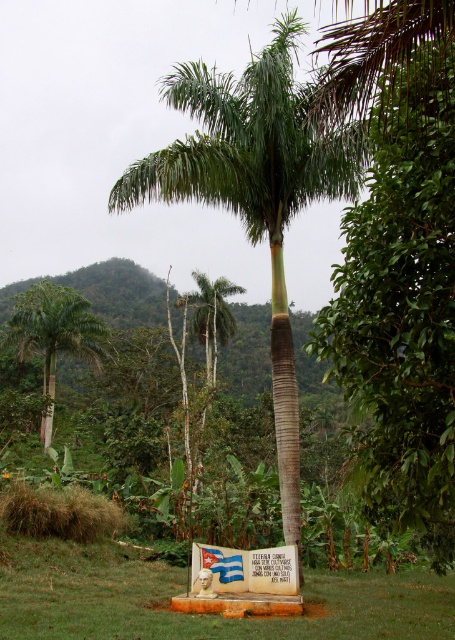
Does green leafy tree at center have a greater width compared to green leafy palm tree at left?

No, green leafy tree at center is not wider than green leafy palm tree at left.

What do you see at coordinates (403, 301) in the screenshot? This screenshot has height=640, width=455. I see `green leafy tree at center` at bounding box center [403, 301].

Who is more forward, (373,388) or (86,353)?

Point (373,388) is more forward.

Where is `green leafy tree at center`? green leafy tree at center is located at coordinates (403, 301).

Between green leafy palm tree at center and green grass at center, which one appears on the left side from the viewer's perspective?

From the viewer's perspective, green leafy palm tree at center appears more on the left side.

Is green leafy palm tree at center wider than green grass at center?

Correct, the width of green leafy palm tree at center exceeds that of green grass at center.

Does point (313, 156) lie behind point (354, 573)?

No.

The width and height of the screenshot is (455, 640). I want to click on green leafy palm tree at center, so click(254, 189).

Can you confirm if green grass at center is positioned above green leafy palm tree at left?

Incorrect, green grass at center is not positioned above green leafy palm tree at left.

In the scene shown: Is green grass at center below green leafy palm tree at left?

Correct, green grass at center is located below green leafy palm tree at left.

Is point (313, 637) closer to viewer compared to point (29, 308)?

Yes, point (313, 637) is closer to viewer.

In order to click on green grass at center in this screenshot , I will do `click(200, 614)`.